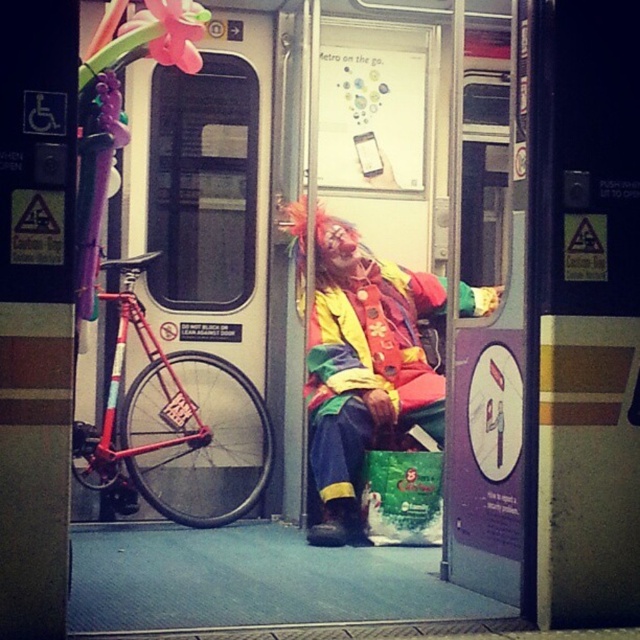
You are a passenger in the subway car and want to exit through the open door. The clown costume is blocking your path. Can you go around the matte clown costume at center to reach the shiny red bicycle at left?

The matte clown costume at center is in front of the shiny red bicycle at left, so you cannot go around the matte clown costume at center to reach the shiny red bicycle at left because the clown is blocking the path.

You are standing at the entrance of the subway car and want to reach the bench where the clown is sitting. Which direction should you move in relation to the point at coordinates point (364, 371)?

The point at coordinates point (364, 371) is where the matte clown costume at center is located. Since the bench with the clown is near the open door, you should move towards the open door, which is away from the point (364, 371) to reach the bench.